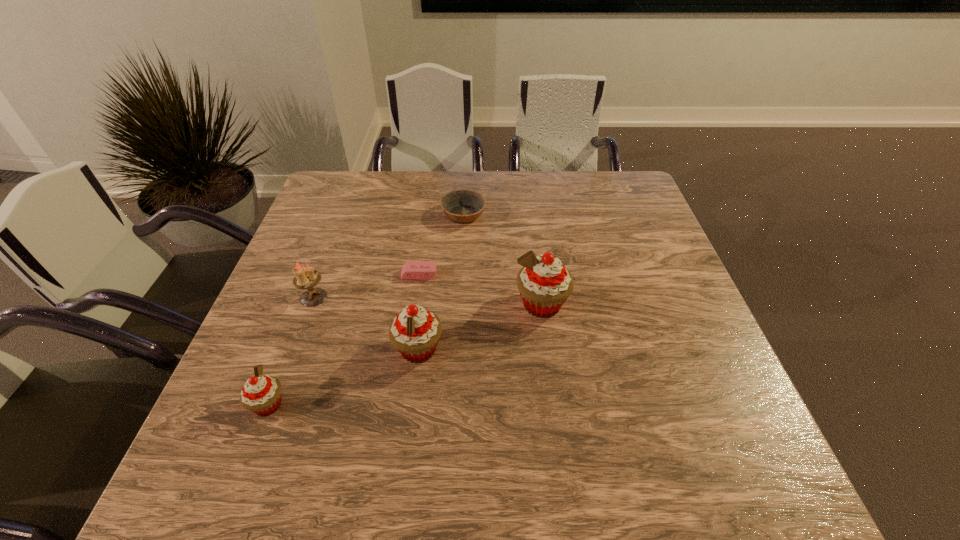
Identify the location of free space between the second farthest cupcake and the bowl. (441, 282).

Where is `free point between the second shortest object and the second cupcake from right to left`? Image resolution: width=960 pixels, height=540 pixels. free point between the second shortest object and the second cupcake from right to left is located at coordinates (441, 282).

Where is `free space between the fifth tallest object and the candle holder`? The width and height of the screenshot is (960, 540). free space between the fifth tallest object and the candle holder is located at coordinates (389, 256).

Identify the location of free space between the second nearest cupcake and the rightmost object. Image resolution: width=960 pixels, height=540 pixels. (480, 327).

Find the location of a particular element. unoccupied position between the candle holder and the shortest object is located at coordinates (367, 286).

Locate an element on the screen. The image size is (960, 540). vacant region between the candle holder and the shortest object is located at coordinates (367, 286).

Locate an element on the screen. the third closest object to the farthest cupcake is located at coordinates (461, 206).

Select which object appears as the fifth closest to the farthest cupcake. Please provide its 2D coordinates. Your answer should be formatted as a tuple, i.e. [(x, y)], where the tuple contains the x and y coordinates of a point satisfying the conditions above.

[(261, 394)]

This screenshot has height=540, width=960. Identify the location of cupcake that is the closest one to the farthest cupcake. (415, 332).

At what (x,y) coordinates should I click in order to perform the action: click on cupcake that stands as the second closest to the candle holder. Please return your answer as a coordinate pair (x, y). Looking at the image, I should click on (261, 394).